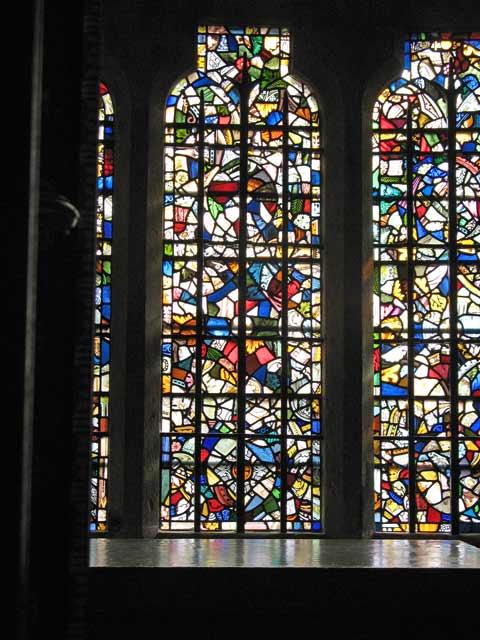
Find the location of `pillars`. pillars is located at coordinates (332, 52), (143, 48).